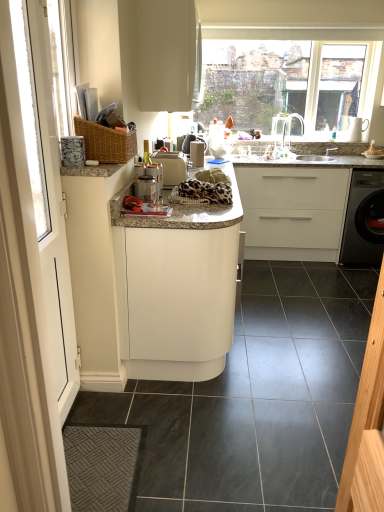
Question: Can you confirm if white glossy screen door at left is shorter than white matte cabinet at center, positioned as the 2th cabinetry in bottom-to-top order?

Choices:
 (A) no
 (B) yes

Answer: (A)

Question: Is white glossy screen door at left smaller than white matte cabinet at center, marked as the 2th cabinetry in a top-to-bottom arrangement?

Choices:
 (A) yes
 (B) no

Answer: (A)

Question: Is white glossy screen door at left facing away from white matte cabinet at center, marked as the 2th cabinetry in a top-to-bottom arrangement?

Choices:
 (A) no
 (B) yes

Answer: (A)

Question: Is white matte cabinet at center, positioned as the 2th cabinetry in bottom-to-top order, a part of white glossy screen door at left?

Choices:
 (A) yes
 (B) no

Answer: (B)

Question: Can you confirm if white glossy screen door at left is positioned to the right of white matte cabinet at center, positioned as the 2th cabinetry in bottom-to-top order?

Choices:
 (A) yes
 (B) no

Answer: (B)

Question: From the image's perspective, is white matte cabinet at center, positioned as the 2th cabinetry in bottom-to-top order, positioned above or below woven wood basket at upper left?

Choices:
 (A) below
 (B) above

Answer: (A)

Question: Is white matte cabinet at center, positioned as the 2th cabinetry in bottom-to-top order, to the left or to the right of woven wood basket at upper left in the image?

Choices:
 (A) right
 (B) left

Answer: (A)

Question: Is white matte cabinet at center, marked as the 2th cabinetry in a top-to-bottom arrangement, inside the boundaries of woven wood basket at upper left, or outside?

Choices:
 (A) outside
 (B) inside

Answer: (A)

Question: Is white matte cabinet at center, marked as the 2th cabinetry in a top-to-bottom arrangement, wider or thinner than woven wood basket at upper left?

Choices:
 (A) thin
 (B) wide

Answer: (B)

Question: Looking at their shapes, would you say satin silver coffee machine at center is wider or thinner than white glossy screen door at left?

Choices:
 (A) wide
 (B) thin

Answer: (A)

Question: In terms of size, does satin silver coffee machine at center appear bigger or smaller than white glossy screen door at left?

Choices:
 (A) small
 (B) big

Answer: (A)

Question: From a real-world perspective, is satin silver coffee machine at center positioned above or below white glossy screen door at left?

Choices:
 (A) above
 (B) below

Answer: (A)

Question: Considering their positions, is satin silver coffee machine at center located in front of or behind white glossy screen door at left?

Choices:
 (A) front
 (B) behind

Answer: (B)

Question: Considering the positions of white matte cabinet at upper center, the 1th cabinetry from the top, and white matte cabinet at center, marked as the 3th cabinetry in a top-to-bottom arrangement, in the image, is white matte cabinet at upper center, the 1th cabinetry from the top, taller or shorter than white matte cabinet at center, marked as the 3th cabinetry in a top-to-bottom arrangement,?

Choices:
 (A) tall
 (B) short

Answer: (B)

Question: Is white matte cabinet at upper center, the 1th cabinetry from the top, situated inside white matte cabinet at center, the 1th cabinetry ordered from the bottom, or outside?

Choices:
 (A) inside
 (B) outside

Answer: (B)